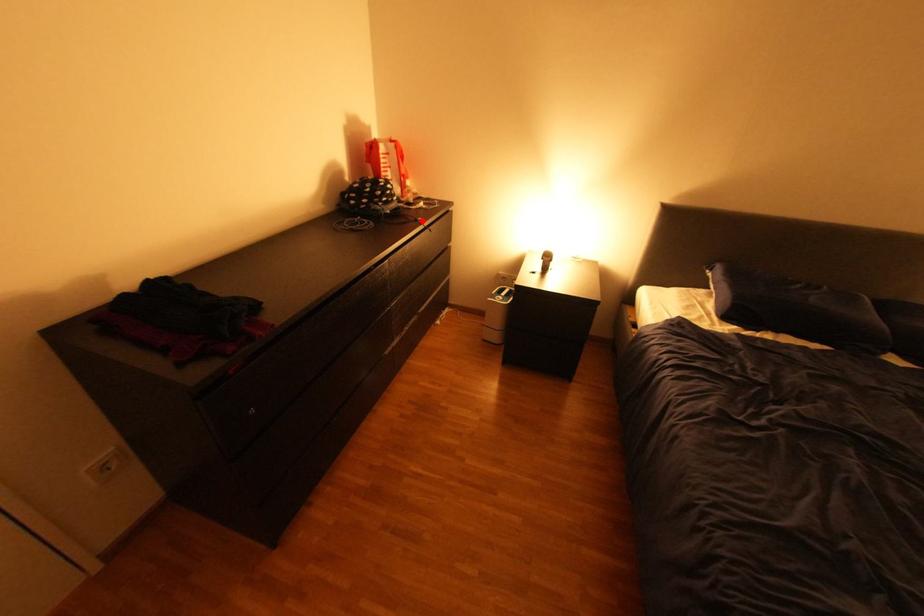
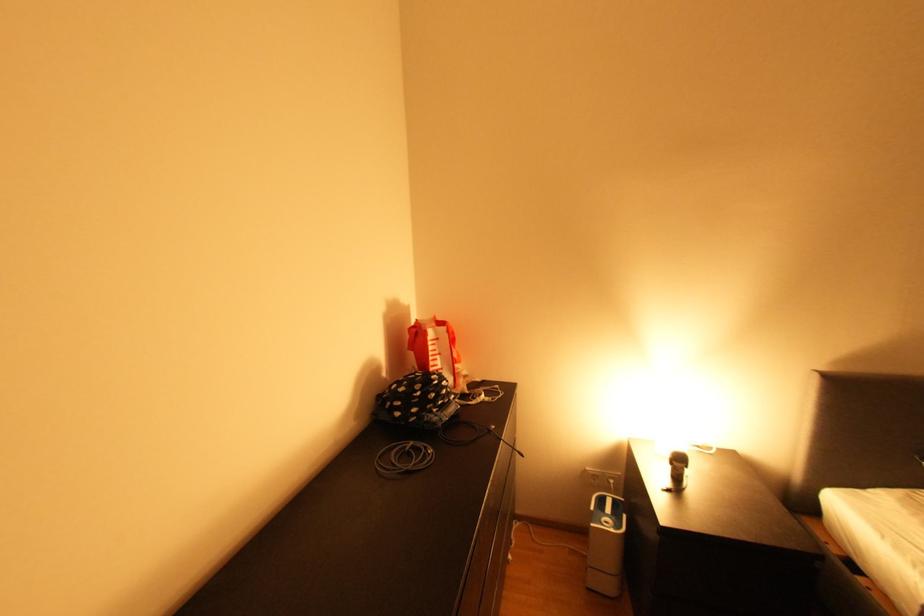
In the second image, find the point that corresponds to the highlighted location in the first image.

(494, 434)